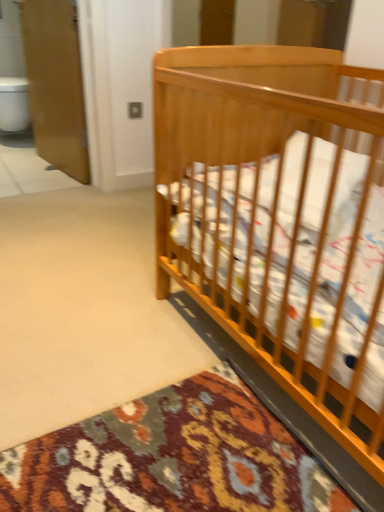
Question: From the image's perspective, is wooden screen door at upper left above white tile at left?

Choices:
 (A) yes
 (B) no

Answer: (A)

Question: Does wooden screen door at upper left contain white tile at left?

Choices:
 (A) no
 (B) yes

Answer: (A)

Question: Considering the relative sizes of wooden screen door at upper left and white tile at left in the image provided, is wooden screen door at upper left smaller than white tile at left?

Choices:
 (A) yes
 (B) no

Answer: (B)

Question: Would you say wooden screen door at upper left is outside white tile at left?

Choices:
 (A) no
 (B) yes

Answer: (B)

Question: From a real-world perspective, is wooden screen door at upper left below white tile at left?

Choices:
 (A) no
 (B) yes

Answer: (A)

Question: From the image's perspective, is wooden screen door at upper left under white tile at left?

Choices:
 (A) no
 (B) yes

Answer: (A)

Question: Considering the relative sizes of white glossy toilet bowl at left and wooden screen door at upper left in the image provided, is white glossy toilet bowl at left smaller than wooden screen door at upper left?

Choices:
 (A) yes
 (B) no

Answer: (A)

Question: Is white glossy toilet bowl at left positioned behind wooden screen door at upper left?

Choices:
 (A) no
 (B) yes

Answer: (B)

Question: Can you confirm if white glossy toilet bowl at left is bigger than wooden screen door at upper left?

Choices:
 (A) no
 (B) yes

Answer: (A)

Question: Is white glossy toilet bowl at left turned away from wooden screen door at upper left?

Choices:
 (A) yes
 (B) no

Answer: (B)

Question: From a real-world perspective, is white glossy toilet bowl at left on wooden screen door at upper left?

Choices:
 (A) no
 (B) yes

Answer: (A)

Question: Is white glossy toilet bowl at left at the right side of wooden screen door at upper left?

Choices:
 (A) yes
 (B) no

Answer: (B)

Question: Is white glossy toilet bowl at left taller than white tile at left?

Choices:
 (A) no
 (B) yes

Answer: (B)